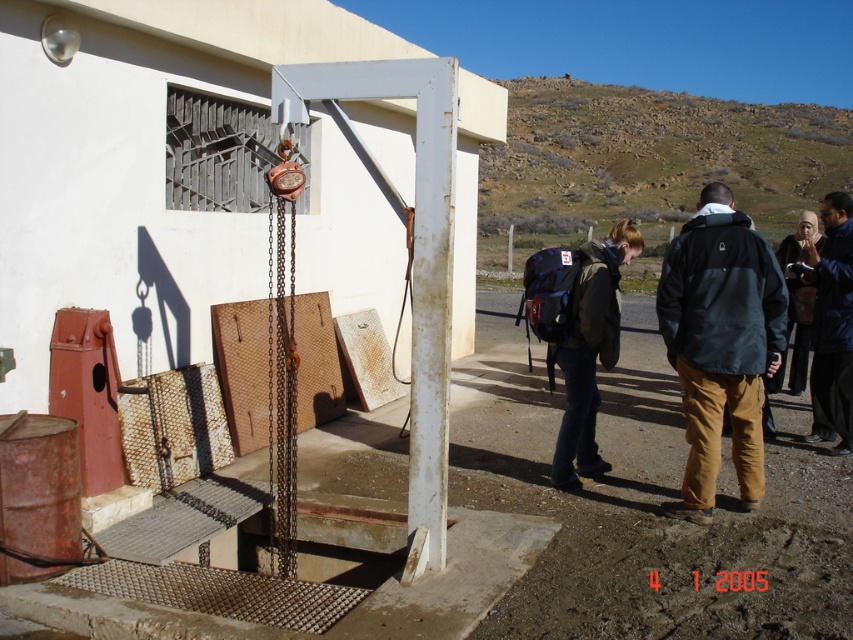
Question: Is black fabric jacket at right closer to the viewer compared to matte green backpack at center?

Choices:
 (A) yes
 (B) no

Answer: (A)

Question: Which object is the farthest from the matte green backpack at center?

Choices:
 (A) dark blue jacket at right
 (B) black fabric jacket at right

Answer: (A)

Question: Among these objects, which one is farthest from the camera?

Choices:
 (A) dark blue jacket at right
 (B) matte green backpack at center
 (C) black fabric jacket at right

Answer: (A)

Question: Does black fabric jacket at right come behind dark blue jacket at right?

Choices:
 (A) yes
 (B) no

Answer: (B)

Question: Can you confirm if matte green backpack at center is bigger than dark blue jacket at right?

Choices:
 (A) no
 (B) yes

Answer: (A)

Question: Which of the following is the closest to the observer?

Choices:
 (A) black fabric jacket at right
 (B) matte green backpack at center

Answer: (A)